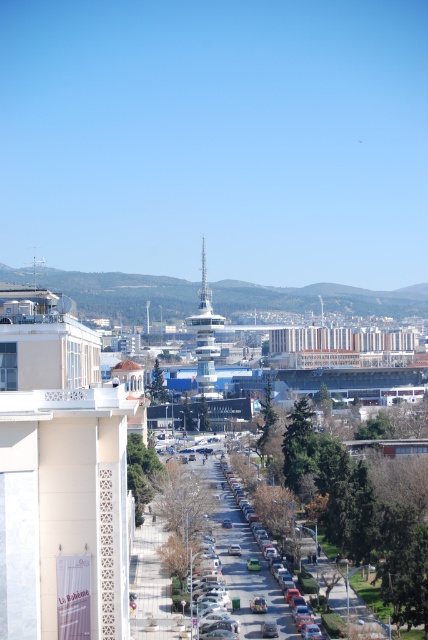
You are a delivery person needing to park your matte silver car at center in a parking spot that can only accommodate vehicles up to the width of the white textured balcony at center. Based on the scene, can your car fit into the parking spot?

The white textured balcony at center is wider than the matte silver car at center, so the car should fit into the parking spot since it is narrower than the balcony.

You are a drone operator tasked with capturing aerial footage of the white textured balcony at center. Your drone has a maximum flight range of 80 meters. Based on the scene, can your drone safely reach the balcony?

The white textured balcony at center is 78.06 meters away from camera, so yes, the drone can safely reach it since the distance is within the 80 meter range.